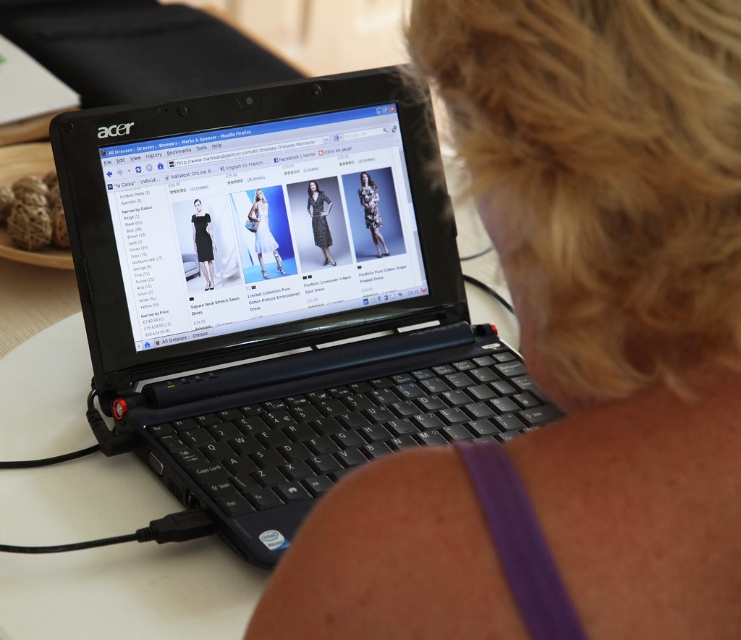
Question: Which point appears closest to the camera in this image?

Choices:
 (A) (330, 208)
 (B) (207, 241)

Answer: (B)

Question: Which of the following is the farthest from the observer?

Choices:
 (A) black satin dress at center
 (B) blonde hair at upper right
 (C) matte black laptop at center

Answer: (A)

Question: Which point appears closest to the camera in this image?

Choices:
 (A) tap(373, 236)
 (B) tap(193, 225)

Answer: (B)

Question: Is white satin dress at center behind floral fabric dress at center?

Choices:
 (A) yes
 (B) no

Answer: (B)

Question: Considering the relative positions of black satin dress at center and floral fabric dress at center in the image provided, where is black satin dress at center located with respect to floral fabric dress at center?

Choices:
 (A) right
 (B) left

Answer: (B)

Question: Considering the relative positions of white satin dress at center and floral fabric dress at center in the image provided, where is white satin dress at center located with respect to floral fabric dress at center?

Choices:
 (A) right
 (B) left

Answer: (B)